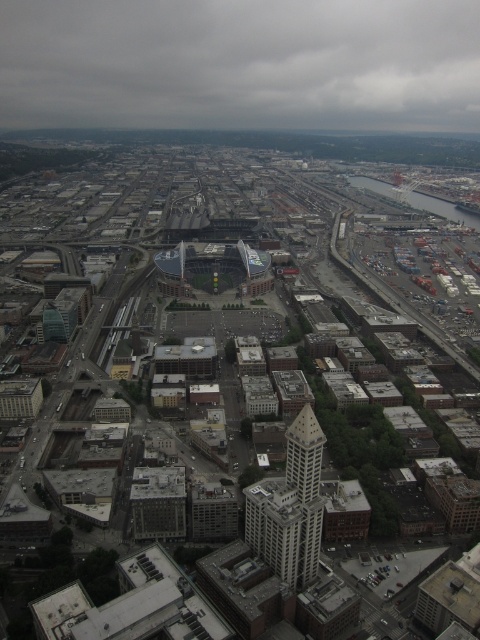
Which is behind, point (202, 118) or point (286, 522)?

The point (202, 118) is more distant.

Does point (436, 61) come behind point (301, 580)?

That is True.

Which is behind, point (19, 8) or point (300, 477)?

Point (19, 8)

Identify the location of gray cloudy sky at upper center. The width and height of the screenshot is (480, 640). (240, 64).